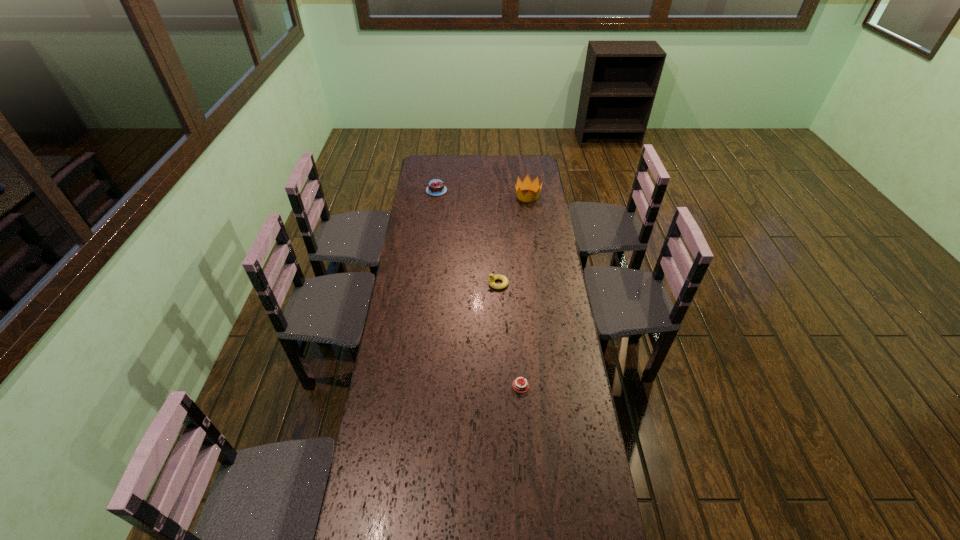
This screenshot has width=960, height=540. In order to click on vacant space that is in between the tallest object and the taller chocolate cake in this screenshot , I will do `click(482, 193)`.

At what (x,y) coordinates should I click in order to perform the action: click on free space between the leftmost object and the shorter chocolate cake. Please return your answer as a coordinate pair (x, y). The height and width of the screenshot is (540, 960). Looking at the image, I should click on (479, 288).

You are a GUI agent. You are given a task and a screenshot of the screen. Output one action in this format:
    pyautogui.click(x=<x>, y=<y>)
    Task: Click on the vacant space in between the duckling and the shorter chocolate cake
    The height and width of the screenshot is (540, 960).
    Given the screenshot: What is the action you would take?
    pyautogui.click(x=509, y=335)

In order to click on free space between the tallest object and the duckling in this screenshot , I will do `click(513, 240)`.

At what (x,y) coordinates should I click in order to perform the action: click on object that can be found as the third closest to the farther chocolate cake. Please return your answer as a coordinate pair (x, y). This screenshot has height=540, width=960. Looking at the image, I should click on (518, 385).

What are the coordinates of `object that is the second nearest to the crown` in the screenshot? It's located at [492, 277].

This screenshot has height=540, width=960. Identify the location of chocolate cake that is the second nearest to the crown. (518, 385).

Identify the location of vacant space that satisfies the following two spatial constraints: 1. on the face of the duckling; 2. on the right side of the nearer chocolate cake. (502, 386).

Locate an element on the screen. The height and width of the screenshot is (540, 960). free space that satisfies the following two spatial constraints: 1. on the face of the second nearest object; 2. on the right side of the shorter chocolate cake is located at coordinates (502, 386).